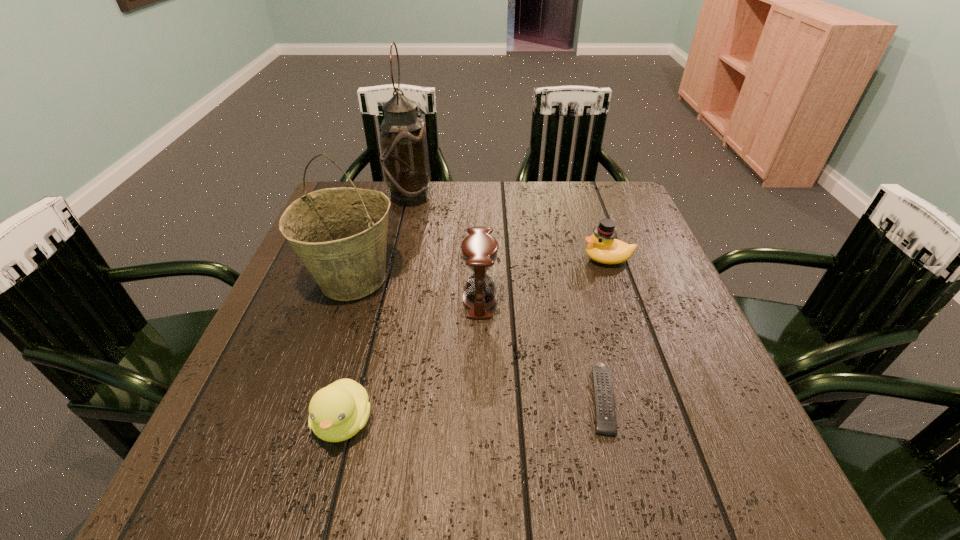
The height and width of the screenshot is (540, 960). What are the coordinates of `the farthest object` in the screenshot? It's located at (404, 157).

Where is `the tallest object`? The width and height of the screenshot is (960, 540). the tallest object is located at coordinates (404, 157).

Identify the location of wine bucket. (340, 234).

This screenshot has height=540, width=960. Find the location of `hourglass`. hourglass is located at coordinates (479, 249).

Where is `the fourth object from left to right`? the fourth object from left to right is located at coordinates (479, 249).

The height and width of the screenshot is (540, 960). Identify the location of duck. (603, 247).

Locate an element on the screen. duckling is located at coordinates (337, 412).

In order to click on the fifth object from left to right in this screenshot , I will do `click(605, 417)`.

The width and height of the screenshot is (960, 540). I want to click on remote control, so click(605, 417).

Find the location of a particular element. vacant space located 0.270m on the front of the oil lamp is located at coordinates (392, 272).